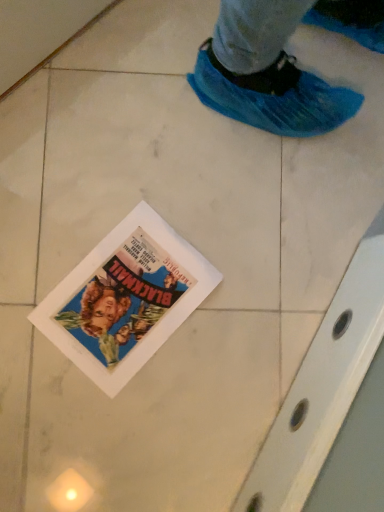
The image size is (384, 512). I want to click on vacant region to the left of white paper at center, so click(44, 221).